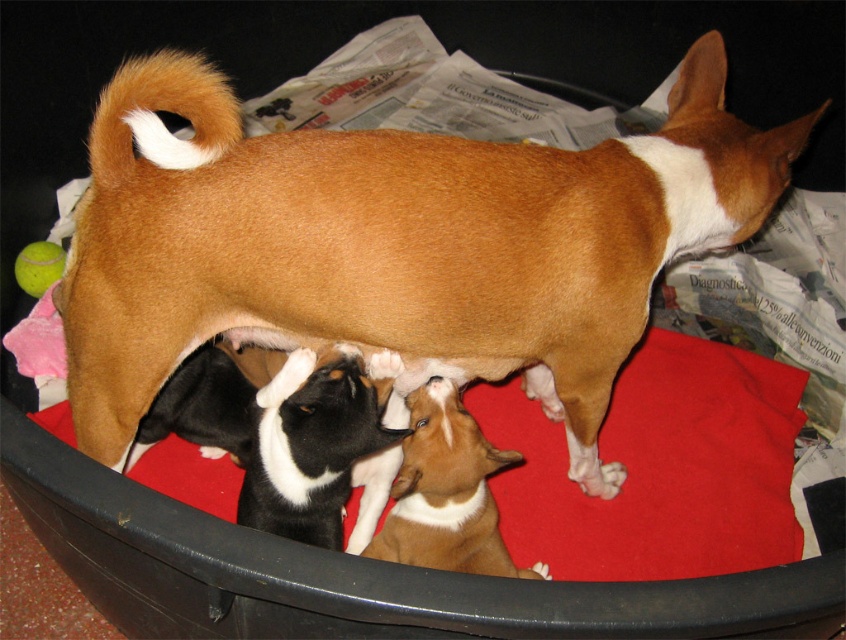
You are a photographer trying to capture a closeup of the brown smooth fur dog at center and the brown smooth fur at center. Which one would appear larger in your photo?

The brown smooth fur dog at center would appear larger in the photo because it is closer to the viewer than the brown smooth fur at center.

You are a photographer trying to capture the mother dog and her puppies. The brown smooth fur dog at center is the mother. Where should you position your camera to ensure the mother dog is the main focus of the photo?

To ensure the mother dog is the main focus, position the camera near the center of the scene since the brown smooth fur dog at center is located at point (x=393, y=243), which is centrally positioned.